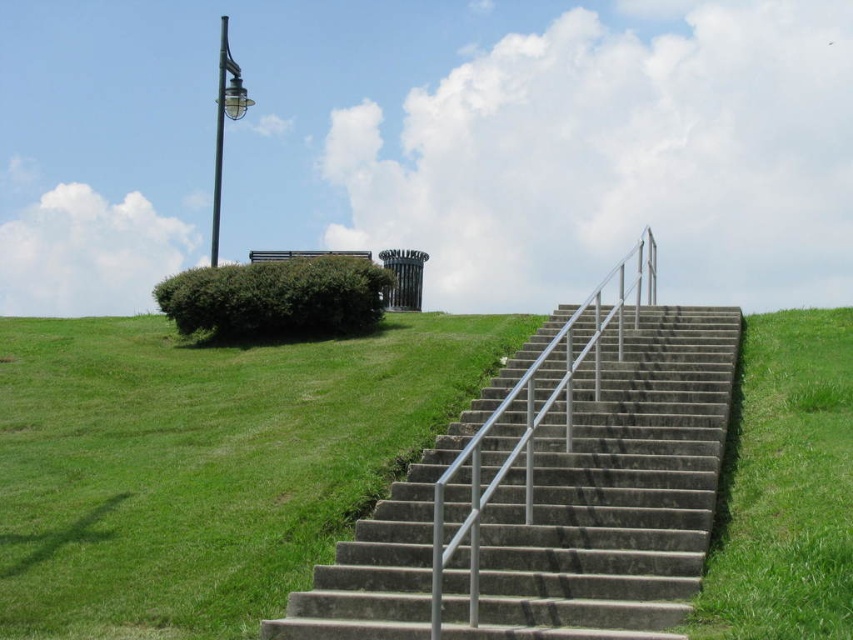
Question: Is concrete/stone stairs at center to the right of silver metallic handrail at center from the viewer's perspective?

Choices:
 (A) yes
 (B) no

Answer: (B)

Question: Among these objects, which one is nearest to the camera?

Choices:
 (A) green leafy bush at upper left
 (B) green grass at lower left

Answer: (B)

Question: Which object is the farthest from the silver metallic handrail at center?

Choices:
 (A) concrete/stone stairs at center
 (B) green leafy bush at upper left

Answer: (B)

Question: Which point is farther to the camera?

Choices:
 (A) green grass at lower left
 (B) green leafy bush at upper left

Answer: (B)

Question: Is green grass at lower left positioned in front of silver metallic handrail at center?

Choices:
 (A) no
 (B) yes

Answer: (A)

Question: Is concrete/stone stairs at center thinner than green leafy bush at upper left?

Choices:
 (A) no
 (B) yes

Answer: (A)